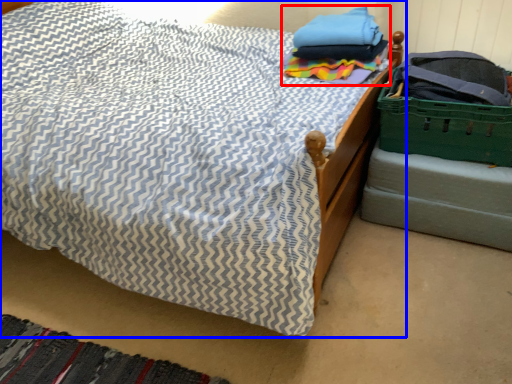
Question: Which of the following is the farthest to the observer, clothing (highlighted by a red box) or bed (highlighted by a blue box)?

Choices:
 (A) clothing
 (B) bed

Answer: (A)